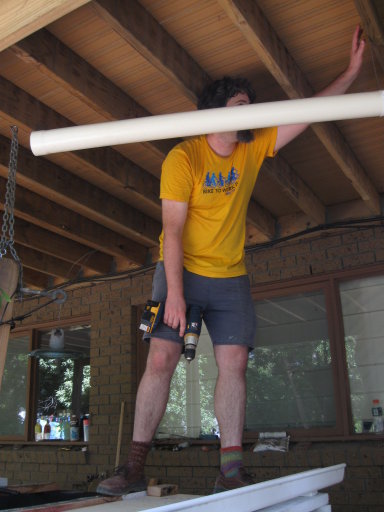
This screenshot has height=512, width=384. What are the coordinates of `window` in the screenshot? It's located at (64, 368), (10, 385), (182, 399), (302, 346), (366, 345).